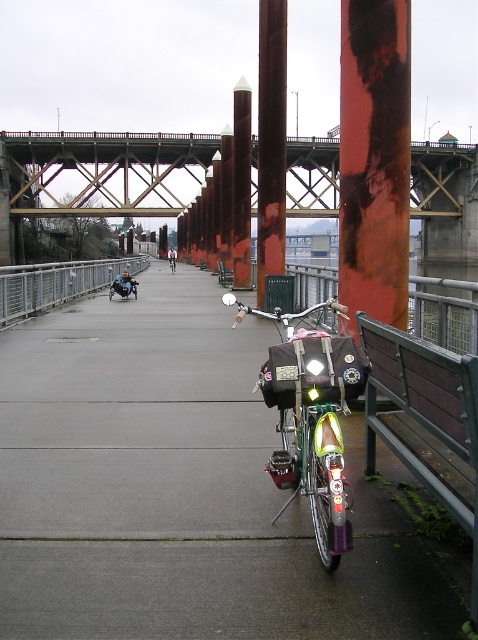
You are a pedestrian standing on the path and want to sit down. There is a rusty metal bridge at upper center and a brown wooden bench at center. Which object is located to the right side of the bench?

The rusty metal bridge at upper center is to the right of the brown wooden bench at center.

You are a delivery person who needs to transport a tall package that is 2 meters in height. You have to decide whether to carry it under the rusty metal bridge at upper center or alongside the shiny metallic bicycle at center. Based on the scene, which location allows the package to pass without hitting the structure?

The rusty metal bridge at upper center is taller than the shiny metallic bicycle at center. Therefore, the package should be carried under the rusty metal bridge at upper center since it has sufficient clearance for the 2m tall package.